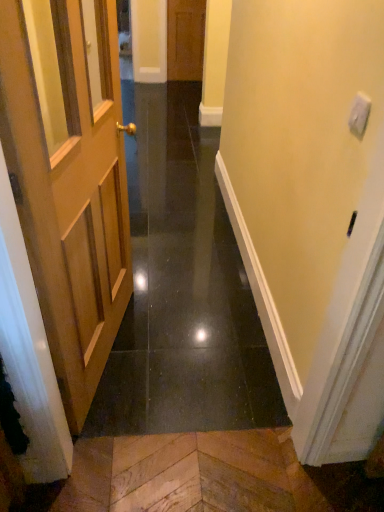
Where is `vacant space underneath light brown wooden door at left, acting as the 1th door starting from the bottom (from a real-world perspective)`? Image resolution: width=384 pixels, height=512 pixels. vacant space underneath light brown wooden door at left, acting as the 1th door starting from the bottom (from a real-world perspective) is located at coordinates (117, 354).